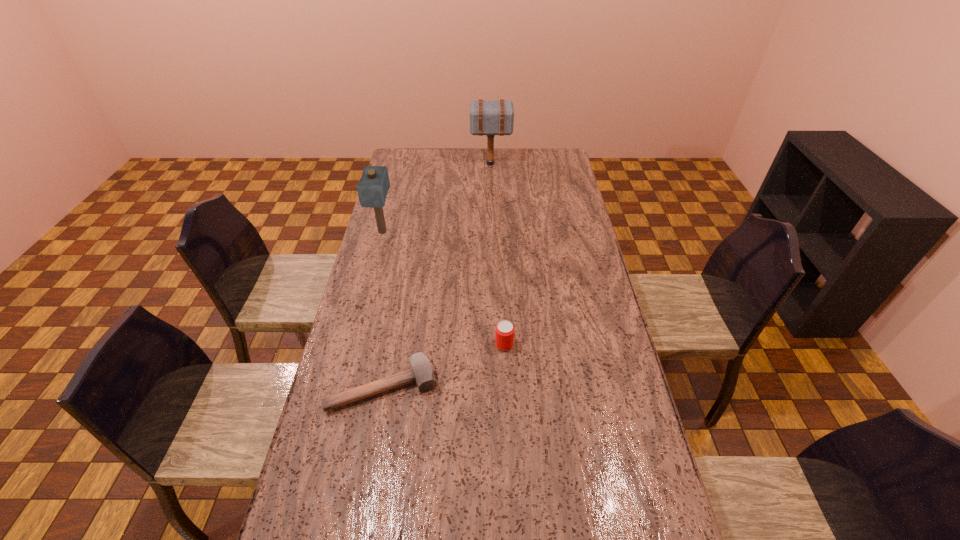
Locate an element on the screen. empty space between the farthest mallet and the nearest object is located at coordinates (437, 275).

Where is `blank region between the third tallest object and the farthest mallet`? This screenshot has height=540, width=960. blank region between the third tallest object and the farthest mallet is located at coordinates (497, 254).

Where is `free space between the beer can and the second farthest object`? free space between the beer can and the second farthest object is located at coordinates (444, 288).

Locate an element on the screen. This screenshot has height=540, width=960. unoccupied area between the second farthest mallet and the beer can is located at coordinates (444, 288).

You are a GUI agent. You are given a task and a screenshot of the screen. Output one action in this format:
    pyautogui.click(x=<x>, y=<y>)
    Task: Click on the free space between the second farthest object and the third farthest object
    
    Given the screenshot: What is the action you would take?
    pyautogui.click(x=444, y=288)

Locate an element on the screen. free space that is in between the beer can and the nearest mallet is located at coordinates (444, 366).

The height and width of the screenshot is (540, 960). I want to click on vacant space in between the nearest mallet and the second nearest object, so click(x=444, y=366).

Choose which object is the second nearest neighbor to the shortest mallet. Please provide its 2D coordinates. Your answer should be formatted as a tuple, i.e. [(x, y)], where the tuple contains the x and y coordinates of a point satisfying the conditions above.

[(372, 189)]

Choose which object is the third nearest neighbor to the third nearest object. Please provide its 2D coordinates. Your answer should be formatted as a tuple, i.e. [(x, y)], where the tuple contains the x and y coordinates of a point satisfying the conditions above.

[(504, 335)]

I want to click on the second closest mallet to the third tallest object, so click(372, 189).